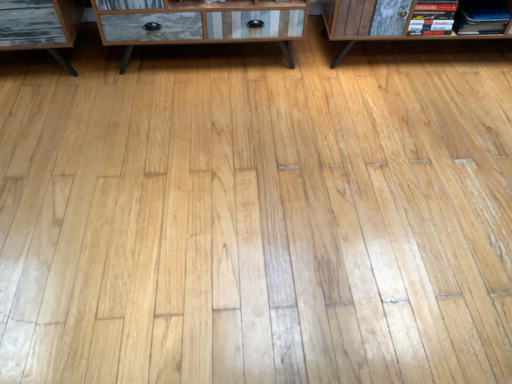
Question: Can you confirm if wooden cabinet at center is thinner than hardcover book at upper right, arranged as the 1th book when viewed from the left?

Choices:
 (A) yes
 (B) no

Answer: (B)

Question: From a real-world perspective, does wooden cabinet at center stand above hardcover book at upper right, arranged as the 1th book when viewed from the left?

Choices:
 (A) yes
 (B) no

Answer: (B)

Question: Does wooden cabinet at center have a greater width compared to hardcover book at upper right, arranged as the 1th book when viewed from the left?

Choices:
 (A) yes
 (B) no

Answer: (A)

Question: Does wooden cabinet at center have a larger size compared to hardcover book at upper right, arranged as the 1th book when viewed from the left?

Choices:
 (A) no
 (B) yes

Answer: (B)

Question: Is wooden cabinet at center to the right of hardcover book at upper right, arranged as the 1th book when viewed from the left, from the viewer's perspective?

Choices:
 (A) yes
 (B) no

Answer: (B)

Question: Is matte black book at upper right, which ranks as the 1th book in right-to-left order, in front of or behind hardcover book at upper right, placed as the second book when sorted from right to left, in the image?

Choices:
 (A) front
 (B) behind

Answer: (B)

Question: From their relative heights in the image, would you say matte black book at upper right, which ranks as the 1th book in right-to-left order, is taller or shorter than hardcover book at upper right, arranged as the 1th book when viewed from the left?

Choices:
 (A) short
 (B) tall

Answer: (A)

Question: Would you say matte black book at upper right, the second book from the left, is inside or outside hardcover book at upper right, arranged as the 1th book when viewed from the left?

Choices:
 (A) inside
 (B) outside

Answer: (B)

Question: In terms of width, does matte black book at upper right, the second book from the left, look wider or thinner when compared to hardcover book at upper right, placed as the second book when sorted from right to left?

Choices:
 (A) thin
 (B) wide

Answer: (B)

Question: Choose the correct answer: Is hardcover book at upper right, arranged as the 1th book when viewed from the left, inside wooden cabinet at center or outside it?

Choices:
 (A) outside
 (B) inside

Answer: (A)

Question: Considering the relative positions of hardcover book at upper right, arranged as the 1th book when viewed from the left, and wooden cabinet at center in the image provided, is hardcover book at upper right, arranged as the 1th book when viewed from the left, to the left or to the right of wooden cabinet at center?

Choices:
 (A) right
 (B) left

Answer: (A)

Question: From a real-world perspective, is hardcover book at upper right, placed as the second book when sorted from right to left, positioned above or below wooden cabinet at center?

Choices:
 (A) below
 (B) above

Answer: (B)

Question: Considering the positions of hardcover book at upper right, arranged as the 1th book when viewed from the left, and wooden cabinet at center in the image, is hardcover book at upper right, arranged as the 1th book when viewed from the left, bigger or smaller than wooden cabinet at center?

Choices:
 (A) small
 (B) big

Answer: (A)

Question: Based on their sizes in the image, would you say wooden cabinet at center is bigger or smaller than matte black book at upper right, which ranks as the 1th book in right-to-left order?

Choices:
 (A) big
 (B) small

Answer: (A)

Question: Considering the positions of wooden cabinet at center and matte black book at upper right, which ranks as the 1th book in right-to-left order, in the image, is wooden cabinet at center taller or shorter than matte black book at upper right, which ranks as the 1th book in right-to-left order,?

Choices:
 (A) short
 (B) tall

Answer: (B)